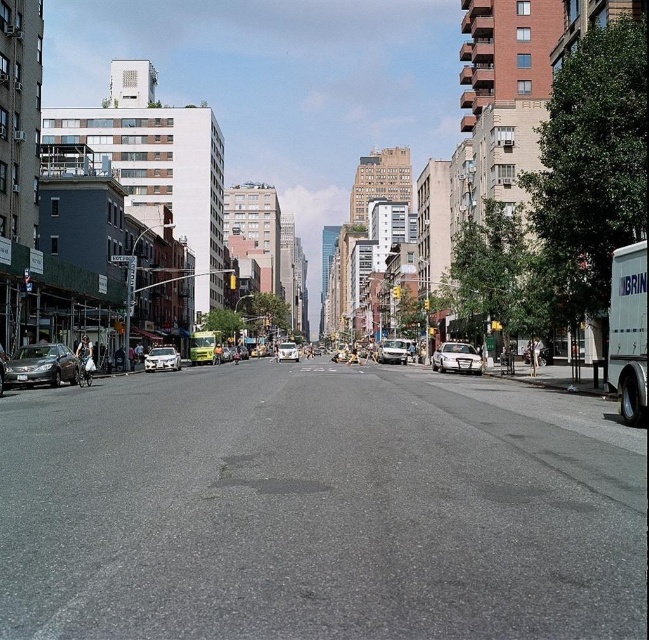
You are standing on the street and looking at two points marked in the image. Which point, point (55, 365) or point (465, 342), is closer to you?

Point (55, 365) is closer to the camera than point (465, 342), so it is closer to you.